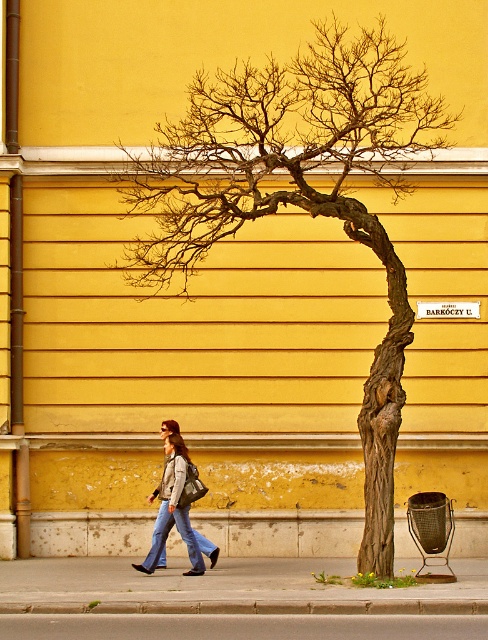
Which is above, brown textured tree trunk at center or denim jacket at lower left?

brown textured tree trunk at center is above.

Is brown textured tree trunk at center bigger than denim jacket at lower left?

Indeed, brown textured tree trunk at center has a larger size compared to denim jacket at lower left.

Image resolution: width=488 pixels, height=640 pixels. I want to click on brown textured tree trunk at center, so click(x=298, y=195).

Locate an element on the screen. brown textured tree trunk at center is located at coordinates (298, 195).

Who is more forward, [189,572] or [182,520]?

Positioned in front is point [189,572].

Between denim jacket at lower left and denim jeans at lower left, which one appears on the left side from the viewer's perspective?

Positioned to the left is denim jacket at lower left.

What do you see at coordinates (175, 508) in the screenshot? The image size is (488, 640). I see `denim jacket at lower left` at bounding box center [175, 508].

Image resolution: width=488 pixels, height=640 pixels. Identify the location of denim jacket at lower left. (175, 508).

Measure the distance between brown textured tree trunk at center and camera.

brown textured tree trunk at center and camera are 16.56 meters apart.

Is point (397, 296) less distant than point (44, 621)?

No, it is behind (44, 621).

At what (x,y) coordinates should I click in order to perform the action: click on brown textured tree trunk at center. Please return your answer as a coordinate pair (x, y). Image resolution: width=488 pixels, height=640 pixels. Looking at the image, I should click on (298, 195).